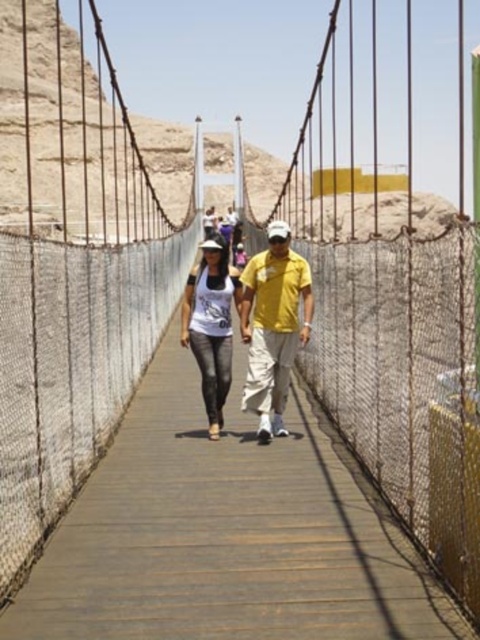
Question: Among these points, which one is farthest from the camera?

Choices:
 (A) (203, 381)
 (B) (289, 260)

Answer: (B)

Question: Can you confirm if yellow matte shirt at center is positioned above matte white tank top at center?

Choices:
 (A) no
 (B) yes

Answer: (A)

Question: Does yellow matte shirt at center appear on the left side of matte white tank top at center?

Choices:
 (A) yes
 (B) no

Answer: (B)

Question: Does yellow matte shirt at center appear under matte white tank top at center?

Choices:
 (A) no
 (B) yes

Answer: (B)

Question: Which point is farther to the camera?

Choices:
 (A) matte white tank top at center
 (B) yellow matte shirt at center

Answer: (A)

Question: Which point is farther to the camera?

Choices:
 (A) (288, 381)
 (B) (202, 268)

Answer: (B)